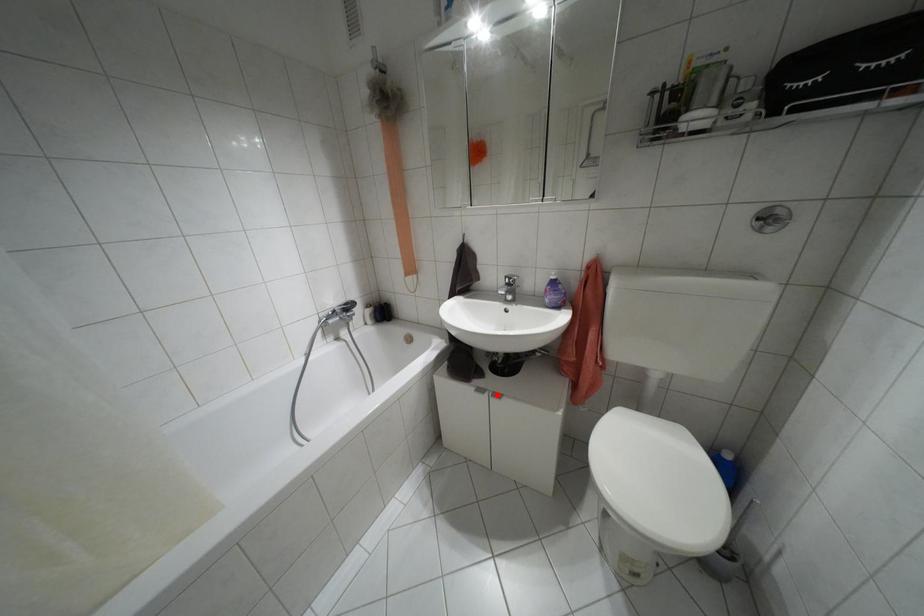
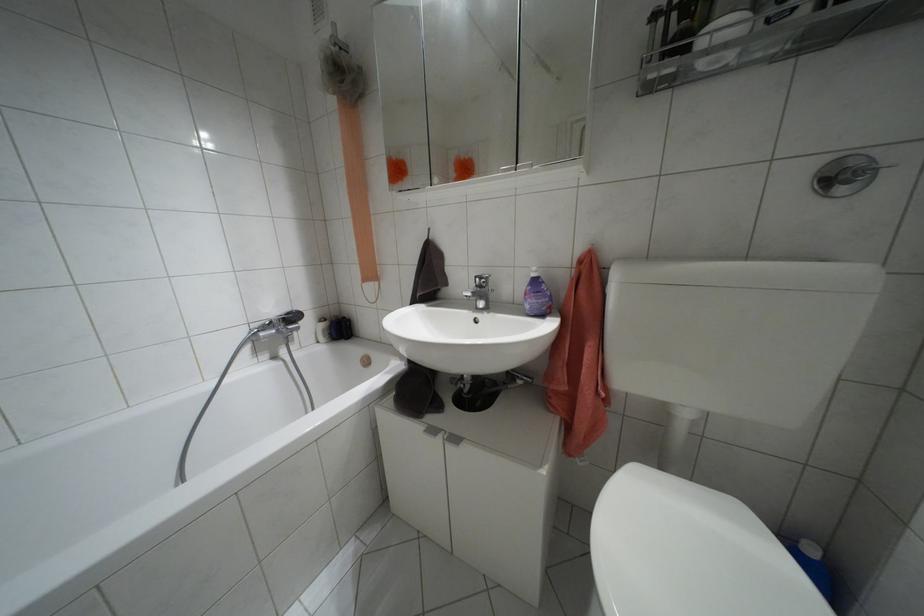
Find the pixel in the second image that matches the highlighted location in the first image.

(455, 439)